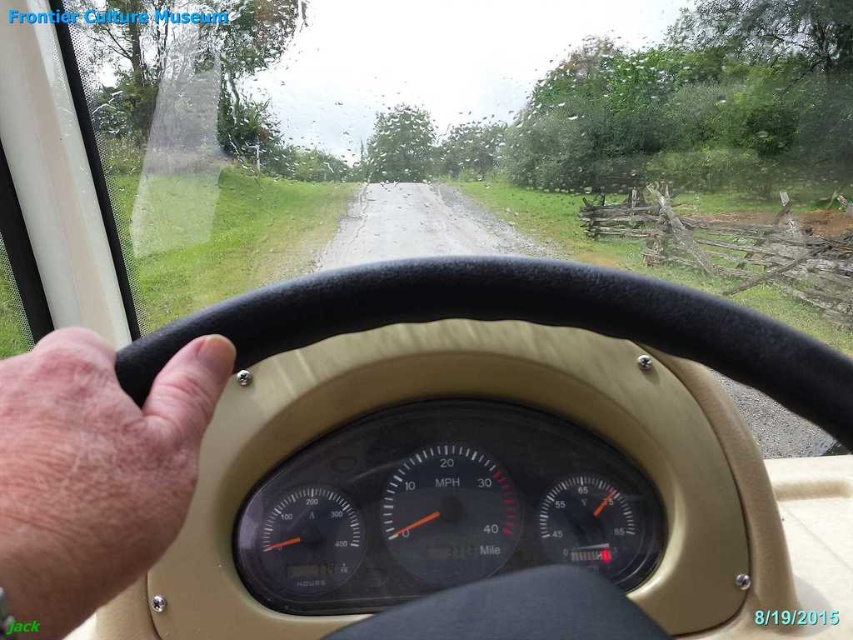
Does black plastic speedometer at center appear over flesh-toned skin at center?

Actually, black plastic speedometer at center is below flesh-toned skin at center.

Where is `black plastic speedometer at center`? black plastic speedometer at center is located at coordinates (440, 508).

Is point (286, 582) positioned after point (30, 449)?

That is True.

Find the location of a particular element. This screenshot has width=853, height=640. black plastic speedometer at center is located at coordinates (440, 508).